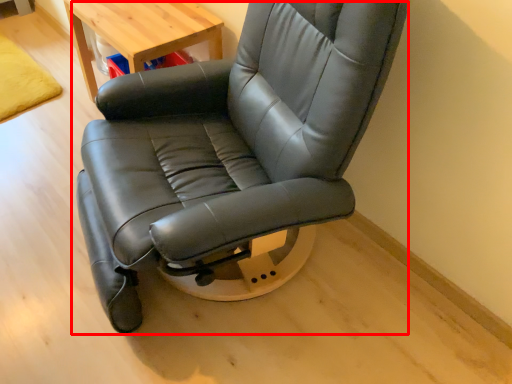
Question: From the image's perspective, what is the correct spatial relationship of chair (annotated by the red box) in relation to table?

Choices:
 (A) above
 (B) below

Answer: (B)